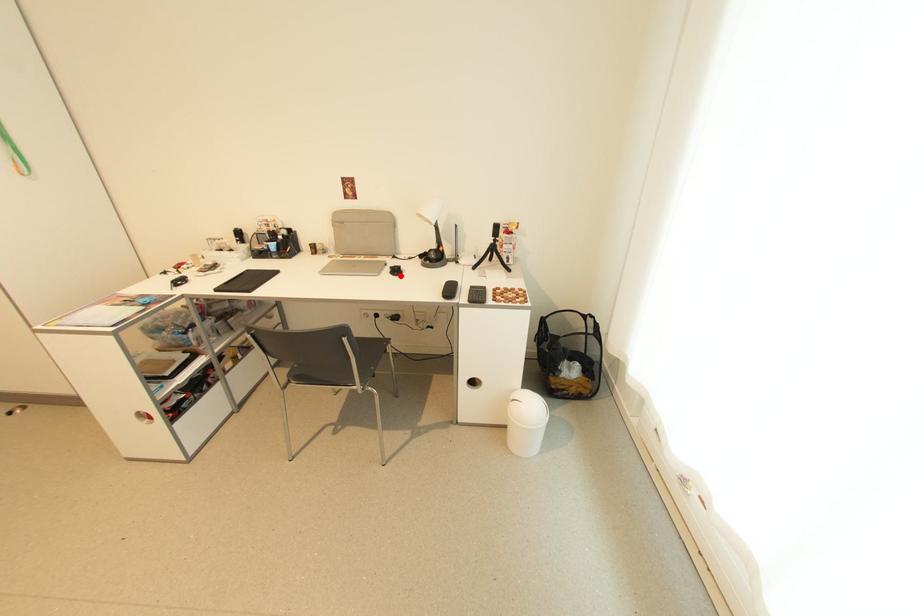
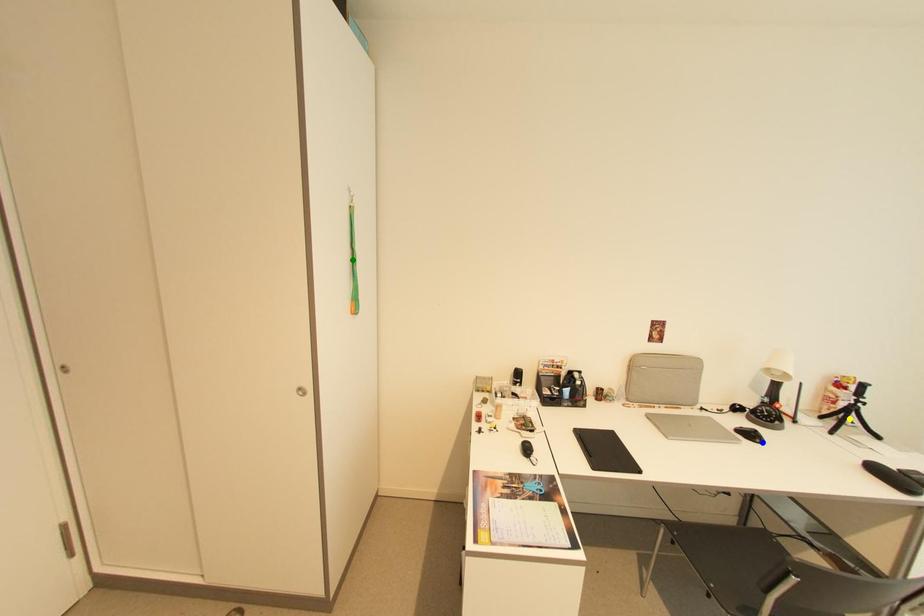
Question: I am providing you with two images of the same scene from different viewpoints. A red point is marked on the first image. You are given multiple points on the second image. Can you choose the point in image 2 that corresponds to the point in image 1?

Choices:
 (A) yellow point
 (B) green point
 (C) blue point

Answer: (C)